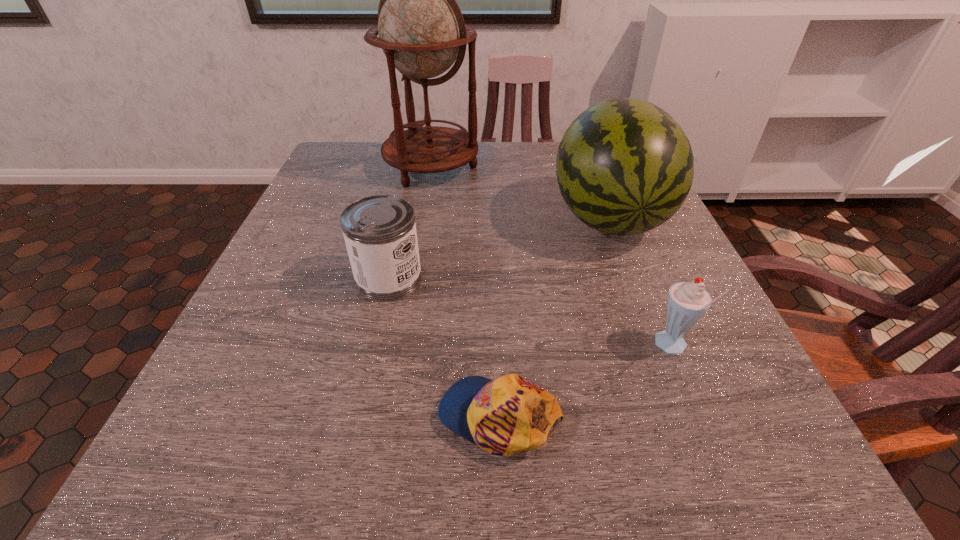
Where is `free point located on the straw side of the second nearest object`? free point located on the straw side of the second nearest object is located at coordinates (423, 347).

The width and height of the screenshot is (960, 540). I want to click on free location located 0.090m on the front of the can, so click(x=374, y=342).

The height and width of the screenshot is (540, 960). What are the coordinates of `vacant area located 0.190m on the bill of the nearest object` in the screenshot? It's located at (300, 416).

The height and width of the screenshot is (540, 960). Find the location of `vacant region located 0.230m on the bill of the nearest object`. vacant region located 0.230m on the bill of the nearest object is located at coordinates (270, 416).

What are the coordinates of `blank space located on the bill of the nearest object` in the screenshot? It's located at (300, 416).

Locate an element on the screen. globe located in the far edge section of the desktop is located at coordinates (421, 29).

Find the location of a particular element. The height and width of the screenshot is (540, 960). watermelon positioned at the far edge is located at coordinates (624, 166).

The image size is (960, 540). In order to click on object that is positioned at the near edge in this screenshot , I will do `click(508, 415)`.

Identify the location of object positioned at the left edge. 421,29.

Identify the location of watermelon at the right edge. This screenshot has width=960, height=540. (624, 166).